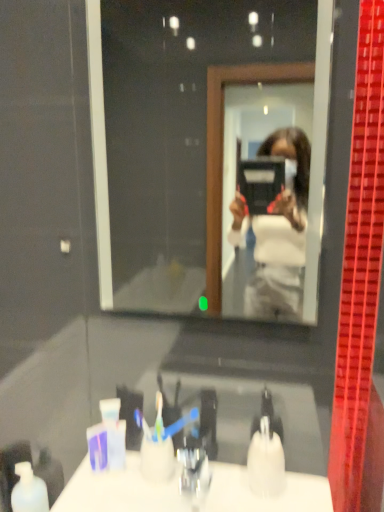
Question: From a real-world perspective, is white matte bottle at lower left located beneath translucent plastic soap dispenser at lower center?

Choices:
 (A) yes
 (B) no

Answer: (A)

Question: Does white matte bottle at lower left touch translucent plastic soap dispenser at lower center?

Choices:
 (A) yes
 (B) no

Answer: (B)

Question: Considering the relative sizes of white matte bottle at lower left and translucent plastic soap dispenser at lower center in the image provided, is white matte bottle at lower left bigger than translucent plastic soap dispenser at lower center?

Choices:
 (A) yes
 (B) no

Answer: (A)

Question: Is white matte bottle at lower left shorter than translucent plastic soap dispenser at lower center?

Choices:
 (A) no
 (B) yes

Answer: (A)

Question: Is white matte bottle at lower left taller than translucent plastic soap dispenser at lower center?

Choices:
 (A) no
 (B) yes

Answer: (B)

Question: Is point (203, 266) closer or farther from the camera than point (236, 477)?

Choices:
 (A) closer
 (B) farther

Answer: (B)

Question: Is clear glass mirror at center inside the boundaries of white glossy counter top at lower center, or outside?

Choices:
 (A) outside
 (B) inside

Answer: (A)

Question: Is clear glass mirror at center to the left or to the right of white glossy counter top at lower center in the image?

Choices:
 (A) left
 (B) right

Answer: (B)

Question: Is clear glass mirror at center wider or thinner than white glossy counter top at lower center?

Choices:
 (A) thin
 (B) wide

Answer: (A)

Question: Considering the positions of white matte bottle at lower left and clear glass mirror at center in the image, is white matte bottle at lower left bigger or smaller than clear glass mirror at center?

Choices:
 (A) small
 (B) big

Answer: (A)

Question: Considering their positions, is white matte bottle at lower left located in front of or behind clear glass mirror at center?

Choices:
 (A) front
 (B) behind

Answer: (B)

Question: Is white matte bottle at lower left taller or shorter than clear glass mirror at center?

Choices:
 (A) tall
 (B) short

Answer: (B)

Question: From a real-world perspective, is white matte bottle at lower left physically located above or below clear glass mirror at center?

Choices:
 (A) above
 (B) below

Answer: (B)

Question: From a real-world perspective, relative to translucent plastic soap dispenser at lower center, is white matte bottle at lower left vertically above or below?

Choices:
 (A) below
 (B) above

Answer: (A)

Question: Visually, is white matte bottle at lower left positioned to the left or to the right of translucent plastic soap dispenser at lower center?

Choices:
 (A) left
 (B) right

Answer: (A)